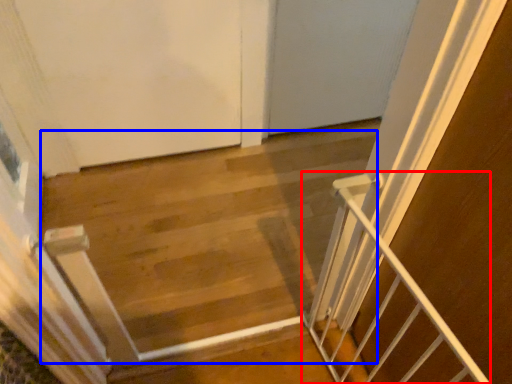
Question: Among these objects, which one is nearest to the camera, stairs (highlighted by a red box) or stairwell (highlighted by a blue box)?

Choices:
 (A) stairs
 (B) stairwell

Answer: (A)